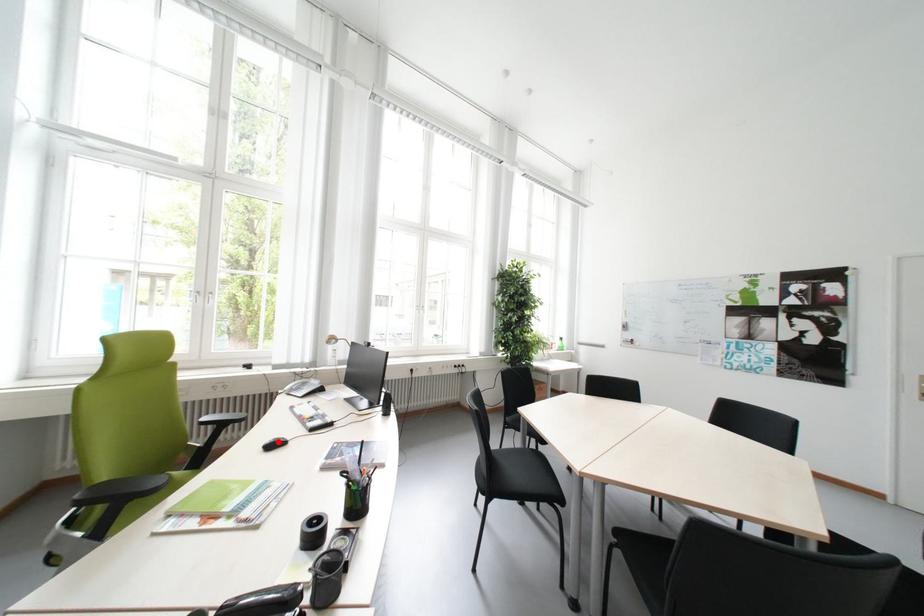
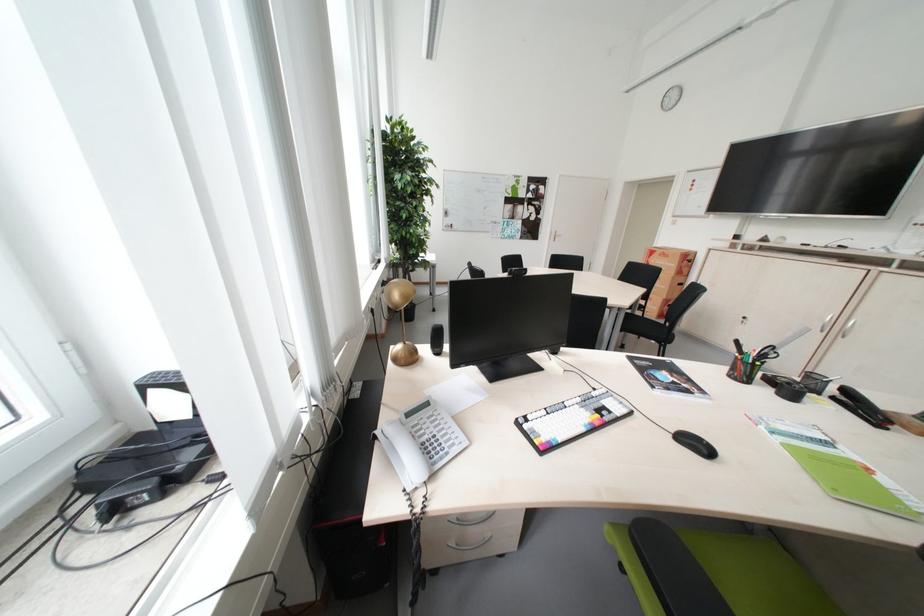
Question: I am providing you with two images of the same scene from different viewpoints. A red point is marked on the first image. Is the red point's position out of view in image 2?

Choices:
 (A) Yes
 (B) No

Answer: (A)